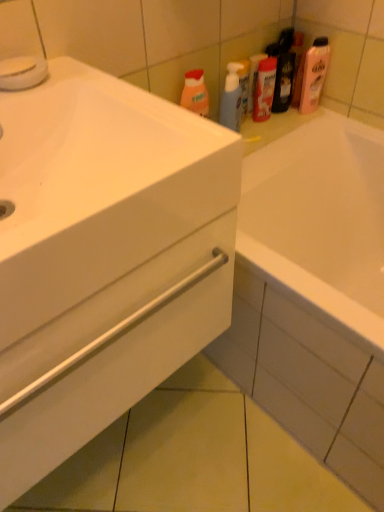
Question: From a real-world perspective, is matte plastic mouthwash at upper center below translucent plastic spray bottle at upper center, which is the first cleaning product from left to right?

Choices:
 (A) yes
 (B) no

Answer: (B)

Question: From the image's perspective, is matte plastic mouthwash at upper center on top of translucent plastic spray bottle at upper center, which is the first cleaning product from left to right?

Choices:
 (A) yes
 (B) no

Answer: (A)

Question: Is matte plastic mouthwash at upper center positioned far away from translucent plastic spray bottle at upper center, which ranks as the 2th cleaning product in right-to-left order?

Choices:
 (A) no
 (B) yes

Answer: (A)

Question: Can you confirm if matte plastic mouthwash at upper center is positioned to the right of translucent plastic spray bottle at upper center, which ranks as the 2th cleaning product in right-to-left order?

Choices:
 (A) no
 (B) yes

Answer: (B)

Question: Is matte plastic mouthwash at upper center with translucent plastic spray bottle at upper center, which ranks as the 2th cleaning product in right-to-left order?

Choices:
 (A) no
 (B) yes

Answer: (A)

Question: Does matte plastic mouthwash at upper center have a greater width compared to translucent plastic spray bottle at upper center, which ranks as the 2th cleaning product in right-to-left order?

Choices:
 (A) yes
 (B) no

Answer: (A)

Question: Are matte plastic mouthwash at upper center and pink glossy lotion at upper right, placed as the first cleaning product when sorted from right to left, beside each other?

Choices:
 (A) yes
 (B) no

Answer: (B)

Question: Is matte plastic mouthwash at upper center bigger than pink glossy lotion at upper right, the second cleaning product positioned from the left?

Choices:
 (A) yes
 (B) no

Answer: (B)

Question: Does matte plastic mouthwash at upper center come in front of pink glossy lotion at upper right, the second cleaning product positioned from the left?

Choices:
 (A) yes
 (B) no

Answer: (B)

Question: Is matte plastic mouthwash at upper center positioned with its back to pink glossy lotion at upper right, the second cleaning product positioned from the left?

Choices:
 (A) no
 (B) yes

Answer: (A)

Question: Is matte plastic mouthwash at upper center surrounding pink glossy lotion at upper right, the second cleaning product positioned from the left?

Choices:
 (A) yes
 (B) no

Answer: (B)

Question: Is matte plastic mouthwash at upper center to the left of pink glossy lotion at upper right, placed as the first cleaning product when sorted from right to left, from the viewer's perspective?

Choices:
 (A) yes
 (B) no

Answer: (A)

Question: Can you confirm if matte plastic mouthwash at upper center is wider than white glossy cabinet at lower left?

Choices:
 (A) no
 (B) yes

Answer: (A)